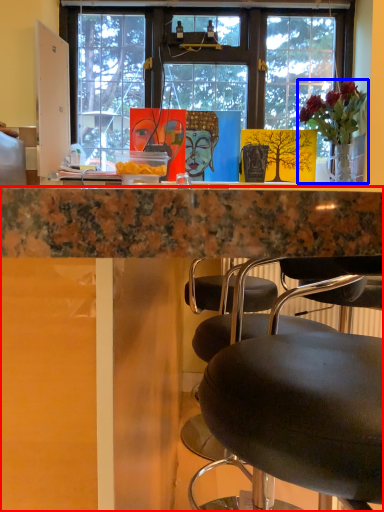
Question: Which of the following is the closest to the observer, desk (highlighted by a red box) or houseplant (highlighted by a blue box)?

Choices:
 (A) desk
 (B) houseplant

Answer: (A)